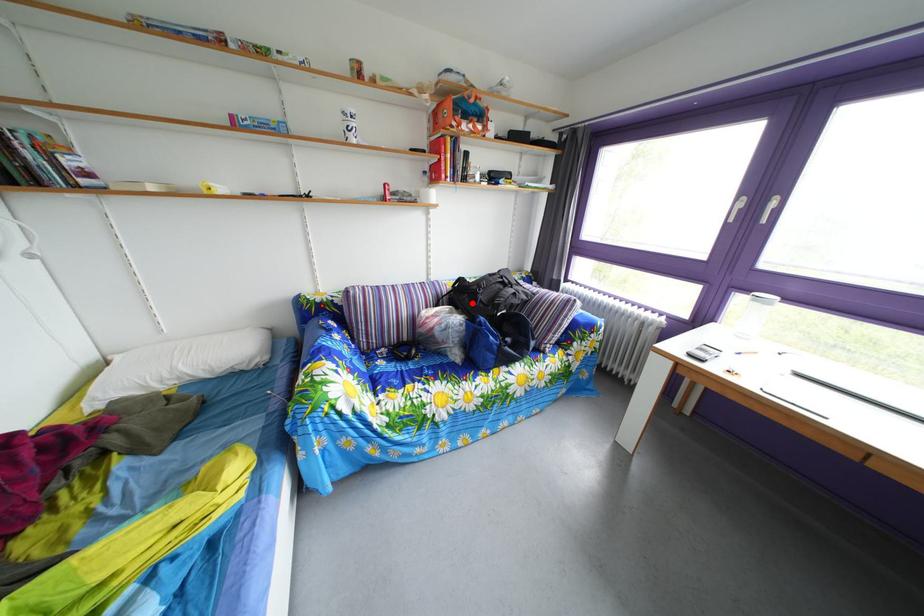
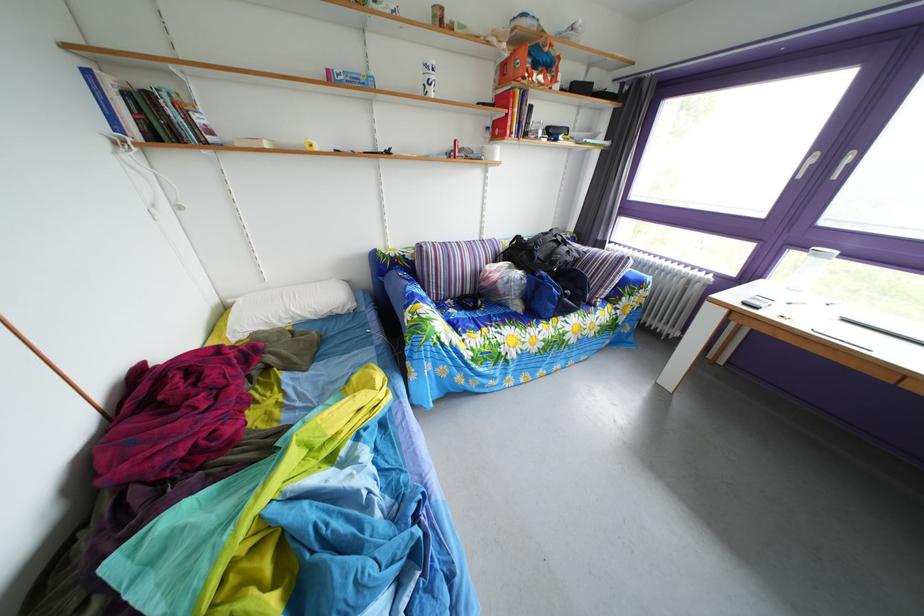
The point at the highlighted location is marked in the first image. Where is the corresponding point in the second image?

(529, 261)